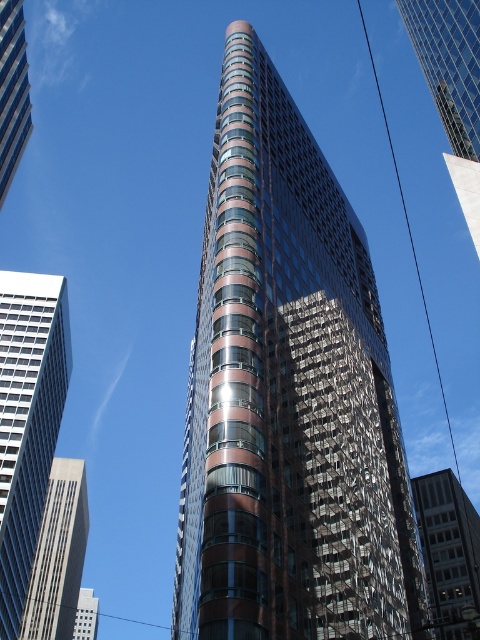
Is white glass skyscraper at left to the left of matte glass skyscraper at left from the viewer's perspective?

Indeed, white glass skyscraper at left is positioned on the left side of matte glass skyscraper at left.

Can you confirm if white glass skyscraper at left is thinner than matte glass skyscraper at left?

Incorrect, white glass skyscraper at left's width is not less than matte glass skyscraper at left's.

Who is more forward, (27, 484) or (10, 77)?

Positioned in front is point (10, 77).

You are a GUI agent. You are given a task and a screenshot of the screen. Output one action in this format:
    pyautogui.click(x=<x>, y=<y>)
    Task: Click on the white glass skyscraper at left
    The height and width of the screenshot is (640, 480).
    Given the screenshot: What is the action you would take?
    pyautogui.click(x=27, y=420)

How distant is brown glass skyscraper at center from glassy reflective building at center?

The distance of brown glass skyscraper at center from glassy reflective building at center is 134.26 feet.

Is brown glass skyscraper at center above glassy reflective building at center?

Yes.

Is point (199, 440) farther from viewer compared to point (468, 518)?

No, it is not.

Find the location of a particular element. brown glass skyscraper at center is located at coordinates (288, 396).

From the picture: Is brown glass skyscraper at center smaller than white glass skyscraper at left?

Incorrect, brown glass skyscraper at center is not smaller in size than white glass skyscraper at left.

How much distance is there between brown glass skyscraper at center and white glass skyscraper at left?

brown glass skyscraper at center is 46.81 meters away from white glass skyscraper at left.

Locate an element on the screen. The height and width of the screenshot is (640, 480). brown glass skyscraper at center is located at coordinates (288, 396).